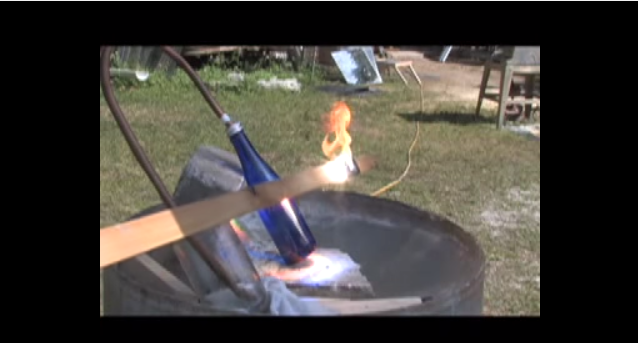
Find the location of a particular element. 1 yellow cord is located at coordinates (401, 177).